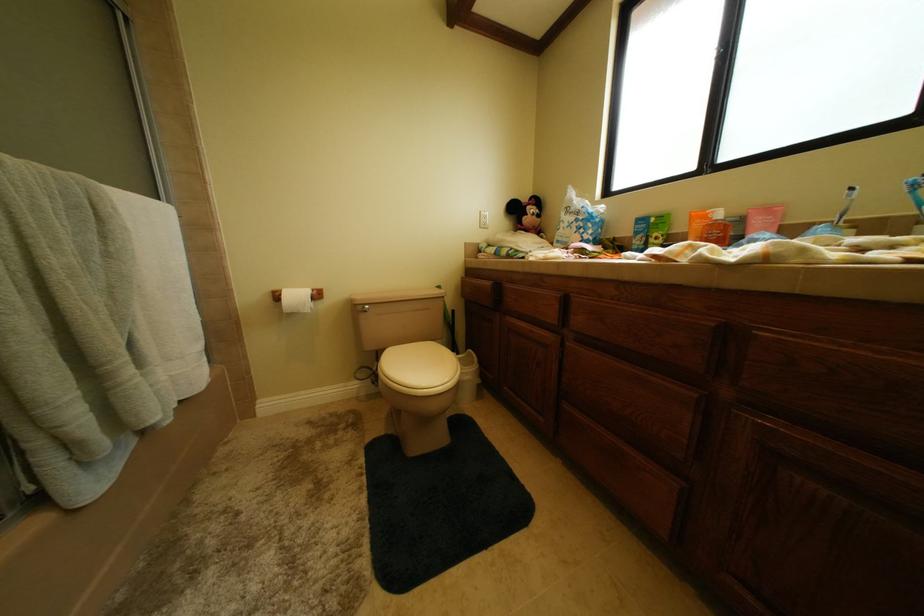
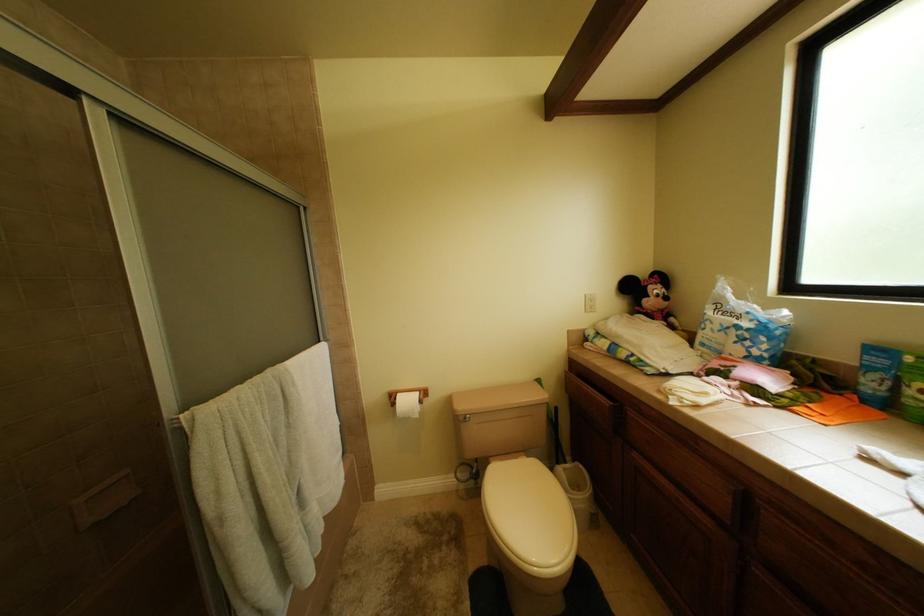
Question: The camera is either moving clockwise (left) or counter-clockwise (right) around the object. The first image is from the beginning of the video and the second image is from the end. Is the camera moving left or right when shooting the video?

Choices:
 (A) Left
 (B) Right

Answer: (B)